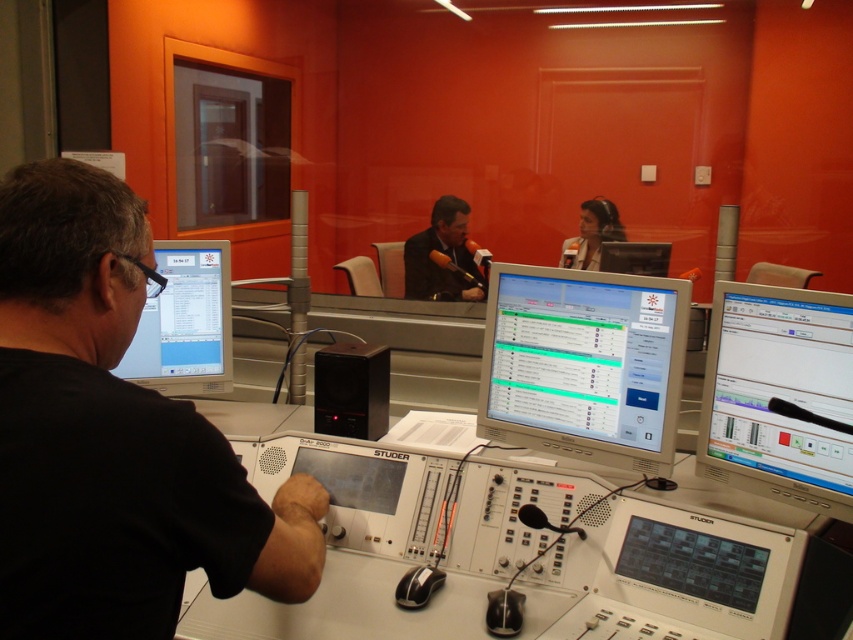
Between white plastic table at center and black matte monitor at left, which one is positioned lower?

white plastic table at center is below.

Which is above, white plastic table at center or black matte monitor at left?

black matte monitor at left is above.

The width and height of the screenshot is (853, 640). I want to click on white plastic table at center, so click(x=389, y=528).

Can you confirm if white plastic control panel at lower center is shorter than dark suit at center?

Indeed, white plastic control panel at lower center has a lesser height compared to dark suit at center.

Which is below, white plastic control panel at lower center or dark suit at center?

Positioned lower is white plastic control panel at lower center.

Is point (619, 508) positioned in front of point (459, 196)?

Yes, it is in front of point (459, 196).

The width and height of the screenshot is (853, 640). I want to click on white plastic control panel at lower center, so click(x=685, y=579).

Between point (535, 636) and point (592, 376), which one is positioned behind?

The point (592, 376) is more distant.

This screenshot has width=853, height=640. In order to click on white plastic table at center in this screenshot , I will do `click(389, 528)`.